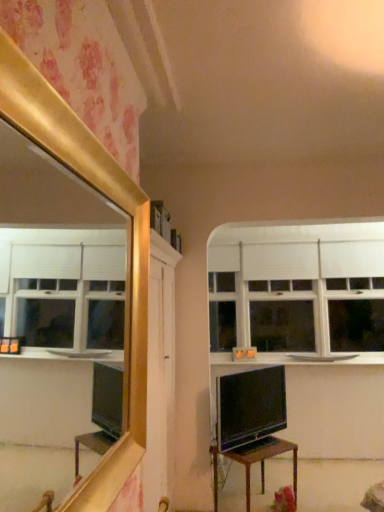
The image size is (384, 512). Describe the element at coordinates (297, 358) in the screenshot. I see `white glossy counter top at upper right` at that location.

The height and width of the screenshot is (512, 384). What do you see at coordinates (250, 407) in the screenshot?
I see `matte black tv at center` at bounding box center [250, 407].

In order to face white matte window at upper center, should I rotate leftwards or rightwards?

Rotate right and turn 13.955 degrees.

Where is `white glossy counter top at upper right`? Image resolution: width=384 pixels, height=512 pixels. white glossy counter top at upper right is located at coordinates (297, 358).

Which is correct: white glossy counter top at upper right is inside wooden table at center, or outside of it?

white glossy counter top at upper right exists outside the volume of wooden table at center.

Which of these two, white glossy counter top at upper right or wooden table at center, is wider?

Wider between the two is wooden table at center.

From their relative heights in the image, would you say white glossy counter top at upper right is taller or shorter than wooden table at center?

Considering their sizes, white glossy counter top at upper right has less height than wooden table at center.

Is point (221, 355) closer to viewer compared to point (331, 354)?

That is False.

From the image's perspective, between white matte window at upper center and white glossy counter top at upper right, which one is located above?

From the image's view, white matte window at upper center is above.

How distant is white matte window at upper center from white glossy counter top at upper right?

white matte window at upper center is 22.08 inches away from white glossy counter top at upper right.

Considering the sizes of objects white matte window at upper center and white glossy counter top at upper right in the image provided, who is taller, white matte window at upper center or white glossy counter top at upper right?

With more height is white matte window at upper center.

Does matte black tv at center touch wooden table at center?

No, matte black tv at center is not with wooden table at center.

Considering the relative sizes of matte black tv at center and wooden table at center in the image provided, is matte black tv at center wider than wooden table at center?

No, matte black tv at center is not wider than wooden table at center.

Is matte black tv at center not within wooden table at center?

matte black tv at center is positioned outside wooden table at center.

Is matte black tv at center smaller than wooden table at center?

Indeed, matte black tv at center has a smaller size compared to wooden table at center.

Can you confirm if matte black tv at center is wider than white glossy counter top at upper right?

In fact, matte black tv at center might be narrower than white glossy counter top at upper right.

Considering the positions of points (254, 415) and (374, 357), is point (254, 415) farther from camera compared to point (374, 357)?

That is False.

Is matte black tv at center touching white glossy counter top at upper right?

matte black tv at center and white glossy counter top at upper right are not in contact.

At what (x,y) coordinates should I click in order to perform the action: click on counter top behind the matte black tv at center. Please return your answer as a coordinate pair (x, y). Looking at the image, I should click on (297, 358).

How much distance is there between wooden table at center and matte black tv at center?

The distance of wooden table at center from matte black tv at center is 9.75 inches.

Is wooden table at center inside the boundaries of matte black tv at center, or outside?

wooden table at center lies outside matte black tv at center.

Which is more to the right, wooden table at center or matte black tv at center?

Positioned to the right is wooden table at center.

Which of these two, wooden table at center or matte black tv at center, is thinner?

Thinner between the two is matte black tv at center.

Considering the points (268, 438) and (255, 260), which point is in front, point (268, 438) or point (255, 260)?

The point (268, 438) is in front.

Can you see wooden table at center touching white matte window at upper center?

No, wooden table at center is not beside white matte window at upper center.

From the image's perspective, is wooden table at center beneath white matte window at upper center?

Yes, from the image's perspective, wooden table at center is below white matte window at upper center.

Locate an element on the screen. The image size is (384, 512). table that is under the white matte window at upper center (from a real-world perspective) is located at coordinates (263, 460).

Can you tell me how much white glossy counter top at upper right and white matte window at upper center differ in facing direction?

0.00108 degrees.

Is the depth of white glossy counter top at upper right greater than that of white matte window at upper center?

No, white glossy counter top at upper right is in front of white matte window at upper center.

Is point (353, 353) positioned behind point (348, 269)?

No, it is not.

From the image's perspective, is white glossy counter top at upper right positioned above or below white matte window at upper center?

white glossy counter top at upper right is below white matte window at upper center.

The height and width of the screenshot is (512, 384). What are the coordinates of `counter top above the wooden table at center (from the image's perspective)` in the screenshot? It's located at (297, 358).

At what (x,y) coordinates should I click in order to perform the action: click on window behind the white glossy counter top at upper right. Please return your answer as a coordinate pair (x, y). This screenshot has width=384, height=512. Looking at the image, I should click on click(x=297, y=291).

In the scene shown: Based on their spatial positions, is white glossy counter top at upper right or matte black tv at center further from white matte window at upper center?

matte black tv at center is positioned further to the anchor white matte window at upper center.

Estimate the real-world distances between objects in this image. Which object is further from wooden table at center, white glossy counter top at upper right or matte black tv at center?

white glossy counter top at upper right is further to wooden table at center.

Considering their positions, is white glossy counter top at upper right positioned further to matte black tv at center than wooden table at center?

white glossy counter top at upper right is positioned further to the anchor matte black tv at center.

When comparing their distances from wooden table at center, does white matte window at upper center or white glossy counter top at upper right seem further?

Result: white matte window at upper center lies further to wooden table at center than the other object.

Looking at this image, from the image, which object appears to be farther from wooden table at center, white matte window at upper center or matte black tv at center?

white matte window at upper center.

Considering their positions, is matte black tv at center positioned closer to white glossy counter top at upper right than white matte window at upper center?

Among the two, white matte window at upper center is located nearer to white glossy counter top at upper right.

Which object lies nearer to the anchor point white glossy counter top at upper right, wooden table at center or matte black tv at center?

matte black tv at center is positioned closer to the anchor white glossy counter top at upper right.

Looking at this image, estimate the real-world distances between objects in this image. Which object is closer to white glossy counter top at upper right, white matte window at upper center or matte black tv at center?

Among the two, white matte window at upper center is located nearer to white glossy counter top at upper right.

The width and height of the screenshot is (384, 512). In order to click on counter top between matte black tv at center and white matte window at upper center from front to back in this screenshot , I will do `click(297, 358)`.

Where is `television located between wooden table at center and white matte window at upper center in the depth direction`? Image resolution: width=384 pixels, height=512 pixels. television located between wooden table at center and white matte window at upper center in the depth direction is located at coordinates (250, 407).

Identify the location of television between wooden table at center and white glossy counter top at upper right along the z-axis. The image size is (384, 512). click(x=250, y=407).

You are a GUI agent. You are given a task and a screenshot of the screen. Output one action in this format:
    pyautogui.click(x=<x>, y=<y>)
    Task: Click on the counter top positioned between wooden table at center and white matte window at upper center from near to far
    The image size is (384, 512).
    Given the screenshot: What is the action you would take?
    pyautogui.click(x=297, y=358)